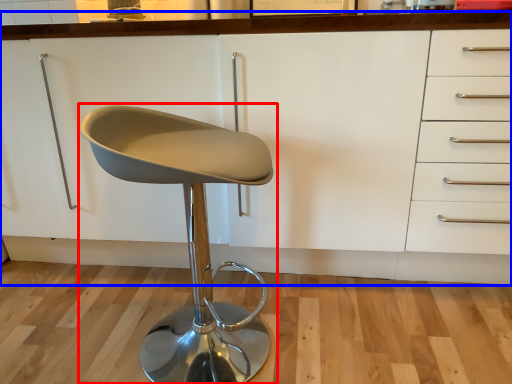
Question: Which object is closer to the camera taking this photo, chair (highlighted by a red box) or cabinetry (highlighted by a blue box)?

Choices:
 (A) chair
 (B) cabinetry

Answer: (A)